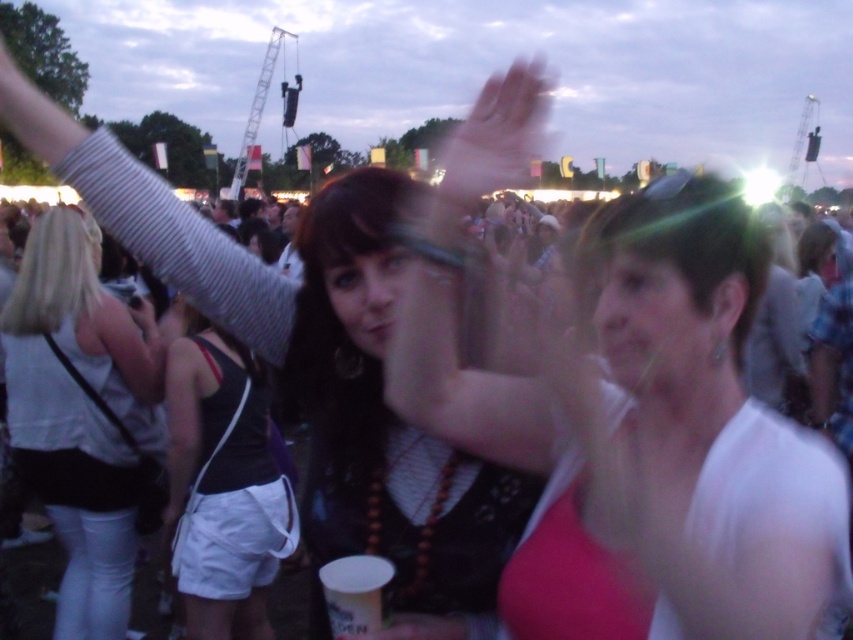
You are standing in the crowd at this event and want to take a photo of both the white matte tank top at upper left and the black fabric tank top at center. Which one should you focus on first to ensure both are in the frame?

You should focus on the white matte tank top at upper left first because it is closer to you than the black fabric tank top at center, ensuring both are in the frame.

You are a photographer at this event and want to capture both the white matte tank top at upper left and the black fabric tank top at center in a single frame. Which tank top should you focus on first to ensure it appears larger in your photo?

The white matte tank top at upper left is larger in size than the black fabric tank top at center, so you should focus on the white matte tank top at upper left first to capture its larger size in the photo.

You are standing at the point with coordinates point (x=479, y=131) and want to move to the exit located at point (x=85, y=593). Considering the spatial relationship between these two points, which direction should you move to reach the exit?

Point (x=85, y=593) is behind point (x=479, y=131), so you should move backward to reach the exit.